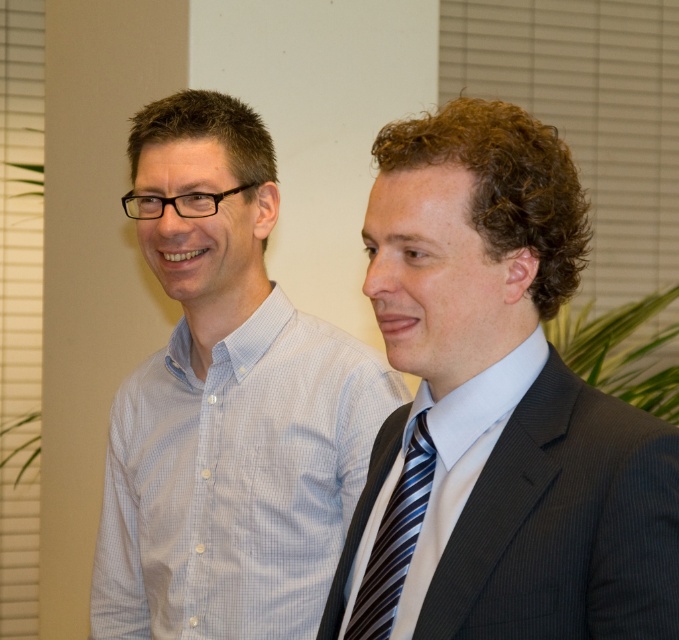
Does light blue woven shirt at right have a lesser height compared to striped silk tie at right?

In fact, light blue woven shirt at right may be taller than striped silk tie at right.

What do you see at coordinates (462, 454) in the screenshot? I see `light blue woven shirt at right` at bounding box center [462, 454].

You are a GUI agent. You are given a task and a screenshot of the screen. Output one action in this format:
    pyautogui.click(x=<x>, y=<y>)
    Task: Click on the light blue woven shirt at right
    This screenshot has height=640, width=679.
    Given the screenshot: What is the action you would take?
    click(x=462, y=454)

Identify the location of light blue woven shirt at right. (462, 454).

Can you confirm if dark gray suit at right is bigger than striped silk tie at right?

Yes.

Between dark gray suit at right and striped silk tie at right, which one appears on the left side from the viewer's perspective?

Positioned to the left is striped silk tie at right.

Is point (545, 262) closer to viewer compared to point (378, 536)?

Yes, point (545, 262) is closer to viewer.

Where is `dark gray suit at right`? dark gray suit at right is located at coordinates (458, 273).

Does point (168, 236) come behind point (477, 419)?

Yes, point (168, 236) is farther from viewer.

Is white checkered shirt at left taller than light blue woven shirt at right?

Yes.

Locate an element on the screen. The height and width of the screenshot is (640, 679). white checkered shirt at left is located at coordinates (225, 403).

This screenshot has width=679, height=640. I want to click on white checkered shirt at left, so click(225, 403).